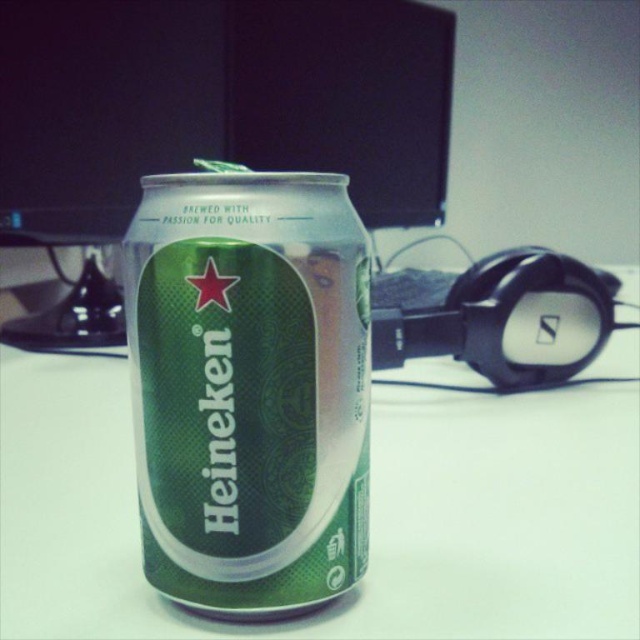
Is green metallic can at center positioned at the back of green textured can at center?

Yes, green metallic can at center is behind green textured can at center.

Is green metallic can at center closer to the viewer compared to green textured can at center?

That is False.

Find the location of `green metallic can at center`. green metallic can at center is located at coordinates (371, 515).